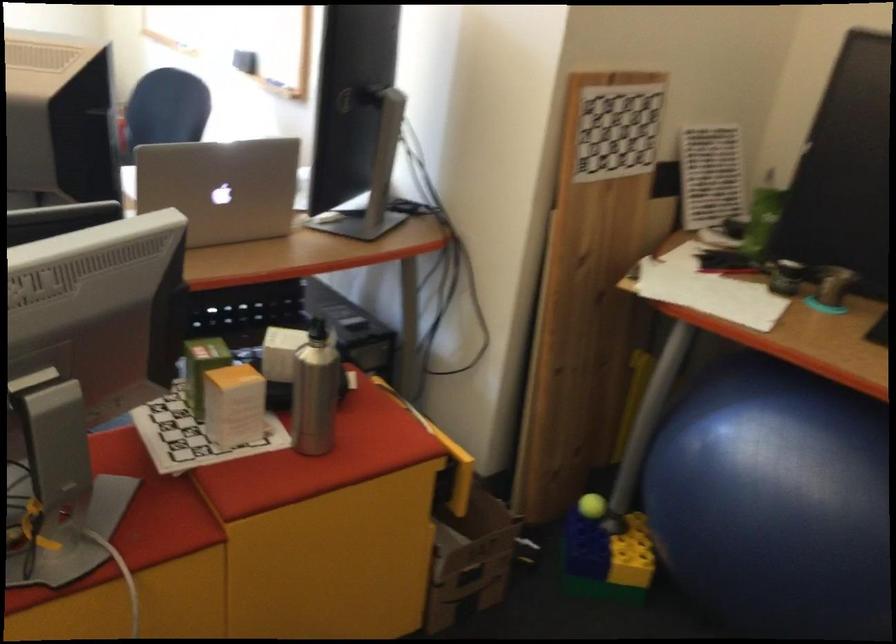
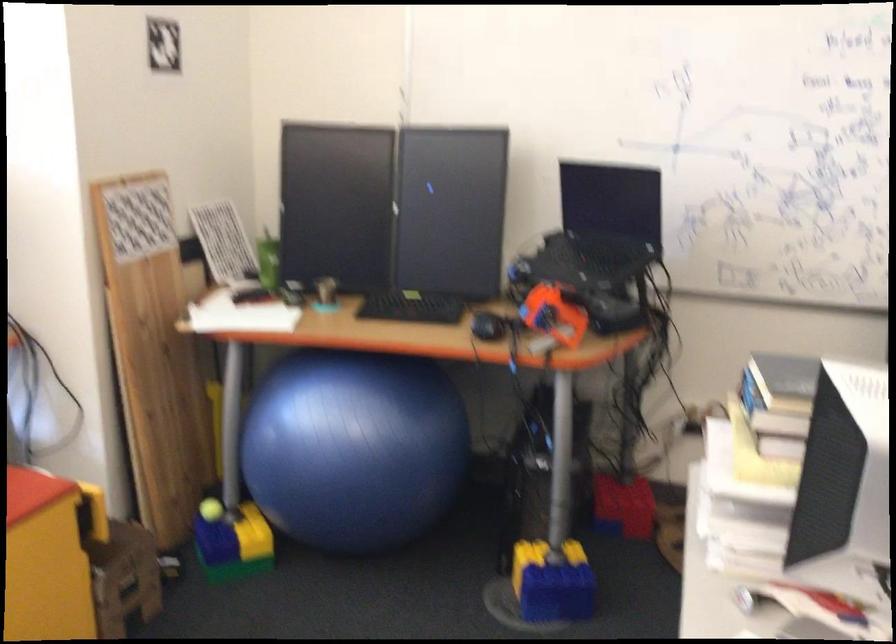
Find the pixel in the second image that matches point 599,550 in the first image.

(231, 534)